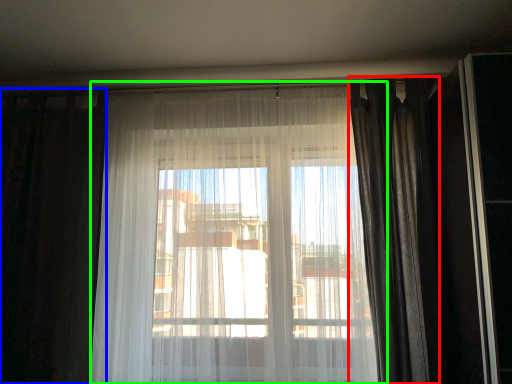
Question: Estimate the real-world distances between objects in this image. Which object is farther from curtain (highlighted by a red box), curtain (highlighted by a blue box) or curtain (highlighted by a green box)?

Choices:
 (A) curtain
 (B) curtain

Answer: (A)